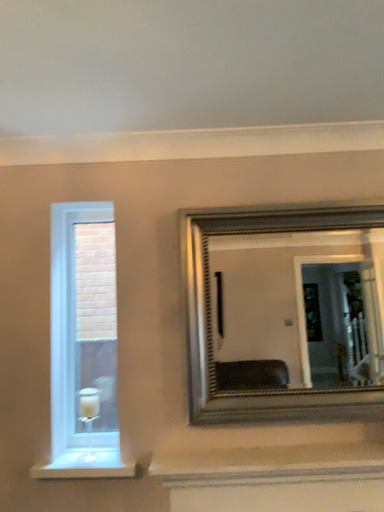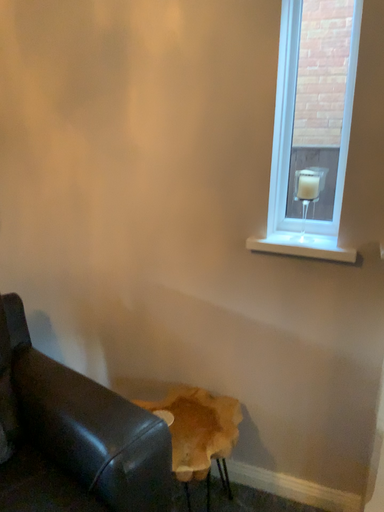
Question: Which way did the camera rotate in the video?

Choices:
 (A) rotated upward
 (B) rotated downward

Answer: (B)